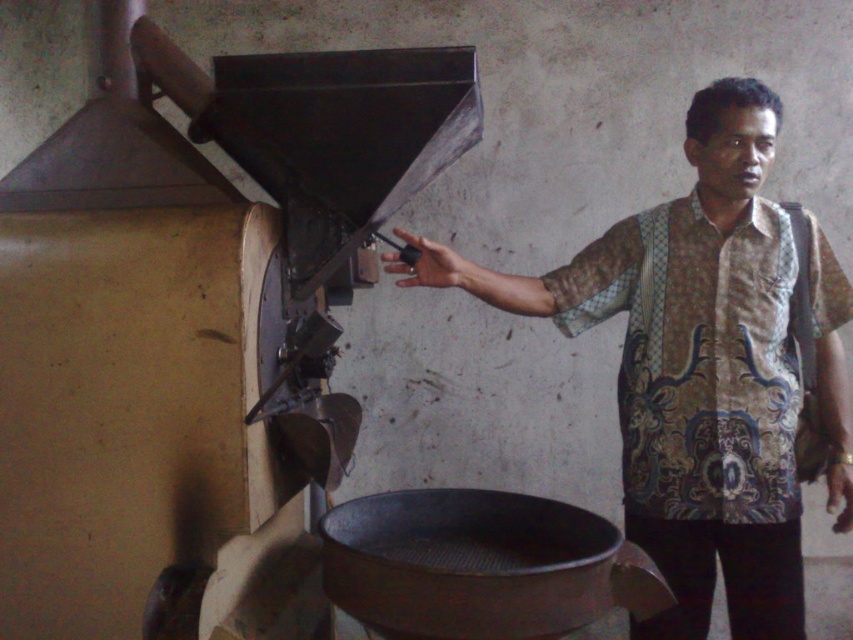
You are an inspector checking the safety of the industrial setup. You notice the batik fabric shirt at right and the metallic at left in the scene. Which object is closer to you from your vantage point?

The batik fabric shirt at right is closer to you because the metallic at left is behind it.

Consider the image. Based on the scene, can the matte brown hand at center reach the metallic at left? Explain using their positions.

The metallic at left is positioned over the matte brown hand at center, so the hand cannot reach it as it is located below the metallic object.